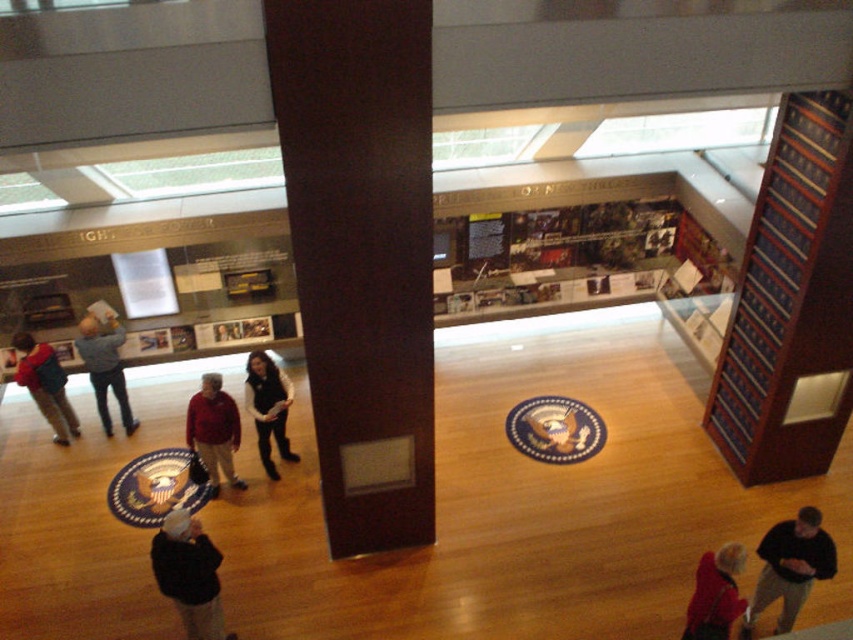
Question: Is velvet black vest at center to the right of matte black backpack at left from the viewer's perspective?

Choices:
 (A) no
 (B) yes

Answer: (B)

Question: Can you confirm if dark gray sweater at lower left is positioned to the right of gray sweater at left?

Choices:
 (A) yes
 (B) no

Answer: (A)

Question: Which point appears farthest from the camera in this image?

Choices:
 (A) (196, 531)
 (B) (711, 573)
 (C) (212, 420)

Answer: (C)

Question: Considering the real-world distances, which object is closest to the dark brown sweater at lower right?

Choices:
 (A) gray sweater at left
 (B) dark brown wood pillar at center
 (C) velvet black vest at center

Answer: (B)

Question: Can you confirm if dark gray sweater at lower left is wider than red velvet coat at lower right?

Choices:
 (A) no
 (B) yes

Answer: (B)

Question: Among these points, which one is farthest from the camera?

Choices:
 (A) (28, 385)
 (B) (693, 605)
 (C) (277, 374)

Answer: (A)